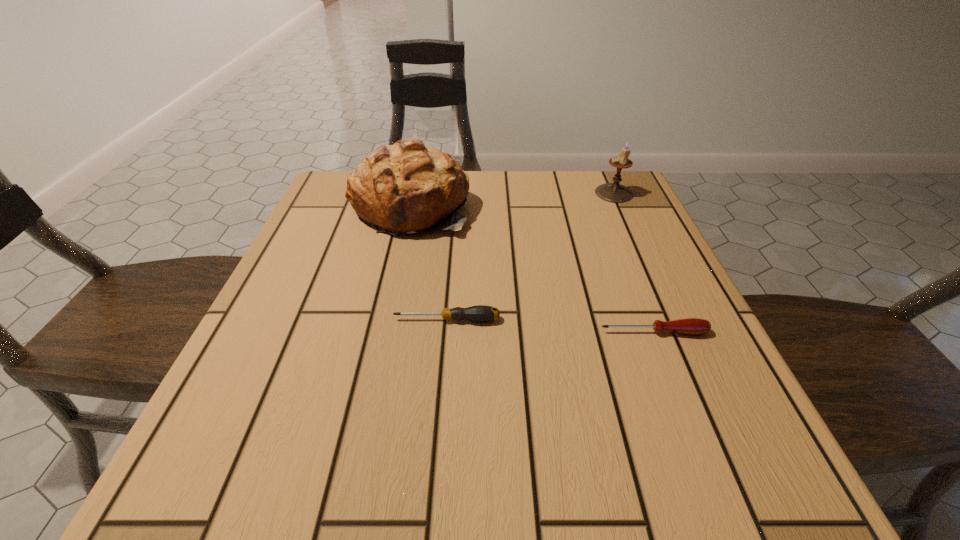
Locate an element on the screen. bread is located at coordinates (406, 187).

The width and height of the screenshot is (960, 540). I want to click on candle holder, so click(614, 192).

I want to click on the left screwdriver, so click(481, 313).

Find the location of a particular element. The height and width of the screenshot is (540, 960). the third farthest object is located at coordinates (481, 313).

In order to click on the right screwdriver in this screenshot , I will do `click(692, 326)`.

Locate an element on the screen. The height and width of the screenshot is (540, 960). the nearest object is located at coordinates (692, 326).

Identify the location of free region located on the front of the bread. pyautogui.click(x=385, y=325).

Find the location of a particular element. This screenshot has height=540, width=960. vacant space located on the left of the candle holder is located at coordinates (523, 193).

Locate an element on the screen. This screenshot has width=960, height=540. vacant space positioned 0.260m on the right of the farther screwdriver is located at coordinates (647, 320).

Where is `vacant space located 0.170m on the back of the right screwdriver`? This screenshot has height=540, width=960. vacant space located 0.170m on the back of the right screwdriver is located at coordinates (627, 264).